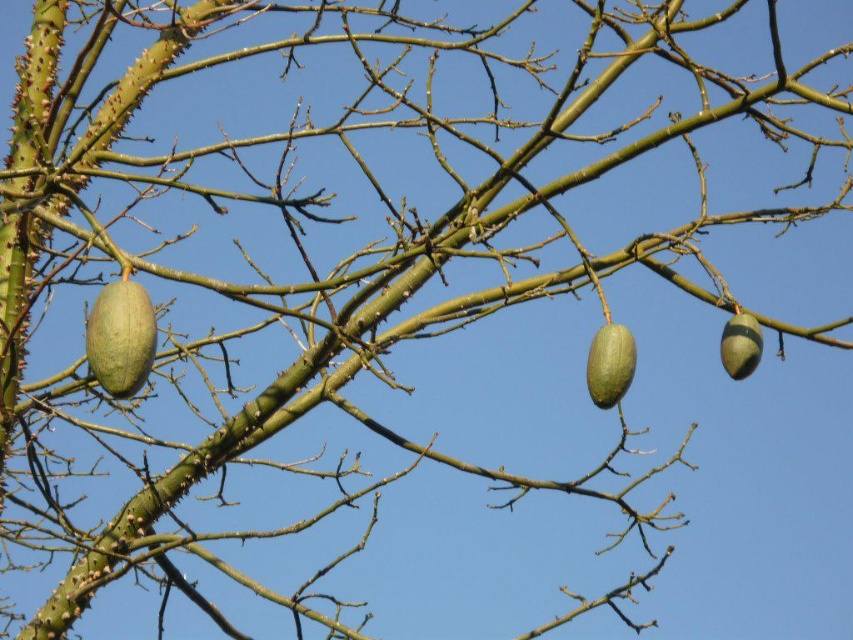
In the scene shown: Between green matte fruit at left and green matte acorn at right, which one appears on the left side from the viewer's perspective?

Positioned to the left is green matte fruit at left.

Describe the element at coordinates (120, 337) in the screenshot. I see `green matte fruit at left` at that location.

At what (x,y) coordinates should I click in order to perform the action: click on green matte fruit at left. Please return your answer as a coordinate pair (x, y). Looking at the image, I should click on (120, 337).

Is green matte fruit at left smaller than green matte fruit at center?

Actually, green matte fruit at left might be larger than green matte fruit at center.

Between point (149, 353) and point (602, 369), which one is positioned behind?

Positioned behind is point (602, 369).

Describe the element at coordinates (120, 337) in the screenshot. I see `green matte fruit at left` at that location.

Identify the location of green matte fruit at left. click(120, 337).

Does green matte fruit at center have a smaller size compared to green matte acorn at right?

Correct, green matte fruit at center occupies less space than green matte acorn at right.

Between point (613, 362) and point (746, 352), which one is positioned behind?

Point (746, 352)

Find the location of a particular element. Image resolution: width=853 pixels, height=640 pixels. green matte fruit at center is located at coordinates (610, 364).

You are a GUI agent. You are given a task and a screenshot of the screen. Output one action in this format:
    pyautogui.click(x=<x>, y=<y>)
    Task: Click on the green matte fruit at center
    
    Given the screenshot: What is the action you would take?
    pyautogui.click(x=610, y=364)